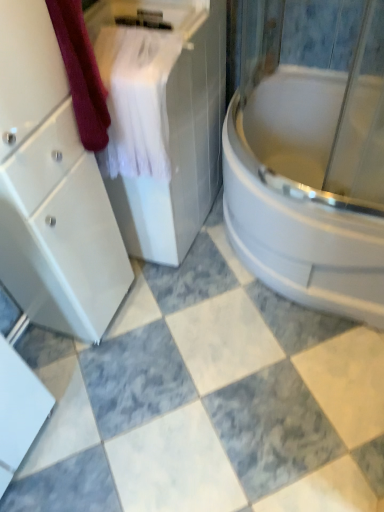
What do you see at coordinates (300, 197) in the screenshot? I see `white glossy bathtub at center right` at bounding box center [300, 197].

What is the approximate height of white glossy bathtub at center right?

It is 21.26 inches.

This screenshot has width=384, height=512. What are the coordinates of `white glossy bathtub at center right` in the screenshot? It's located at (300, 197).

The image size is (384, 512). Find the location of `white glossy bathtub at center right`. white glossy bathtub at center right is located at coordinates (300, 197).